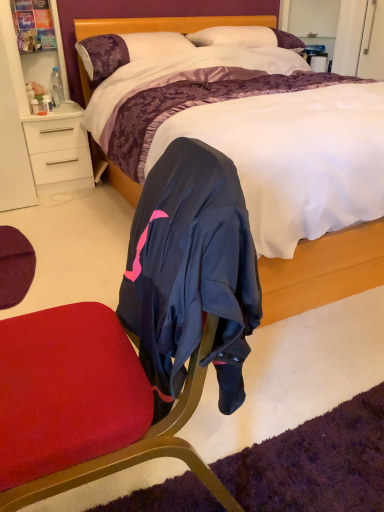
Question: Which direction should I rotate to look at white soft pillow at upper center, acting as the 1th pillow starting from the right, — up or down?

Choices:
 (A) down
 (B) up

Answer: (B)

Question: From a real-world perspective, is white soft pillow at upper center, acting as the 2th pillow starting from the left, positioned over clear plastic bottle at left based on gravity?

Choices:
 (A) yes
 (B) no

Answer: (A)

Question: Is white soft pillow at upper center, acting as the 1th pillow starting from the right, taller than clear plastic bottle at left?

Choices:
 (A) yes
 (B) no

Answer: (A)

Question: Can you confirm if white soft pillow at upper center, acting as the 1th pillow starting from the right, is wider than clear plastic bottle at left?

Choices:
 (A) yes
 (B) no

Answer: (A)

Question: Is the depth of white soft pillow at upper center, acting as the 1th pillow starting from the right, less than that of clear plastic bottle at left?

Choices:
 (A) yes
 (B) no

Answer: (A)

Question: Is white soft pillow at upper center, acting as the 2th pillow starting from the left, shorter than clear plastic bottle at left?

Choices:
 (A) no
 (B) yes

Answer: (A)

Question: Can clear plastic bottle at left be found inside white soft pillow at upper center, acting as the 1th pillow starting from the right?

Choices:
 (A) yes
 (B) no

Answer: (B)

Question: Does clear plastic bottle at left contain white soft pillow at upper center, acting as the 1th pillow starting from the right?

Choices:
 (A) no
 (B) yes

Answer: (A)

Question: Does clear plastic bottle at left come in front of white soft pillow at upper center, acting as the 1th pillow starting from the right?

Choices:
 (A) yes
 (B) no

Answer: (B)

Question: From a real-world perspective, does clear plastic bottle at left stand above white soft pillow at upper center, acting as the 1th pillow starting from the right?

Choices:
 (A) yes
 (B) no

Answer: (B)

Question: Is clear plastic bottle at left aimed at white soft pillow at upper center, acting as the 1th pillow starting from the right?

Choices:
 (A) no
 (B) yes

Answer: (A)

Question: From the image's perspective, would you say clear plastic bottle at left is shown under white soft pillow at upper center, acting as the 2th pillow starting from the left?

Choices:
 (A) yes
 (B) no

Answer: (A)

Question: Is clear plastic bottle at left shorter than white soft pillow at upper center, acting as the 2th pillow starting from the left?

Choices:
 (A) yes
 (B) no

Answer: (A)

Question: Does white soft pillow at upper center, acting as the 2th pillow starting from the left, appear on the left side of purple satin pillow at upper left, the 1th pillow when ordered from left to right?

Choices:
 (A) yes
 (B) no

Answer: (B)